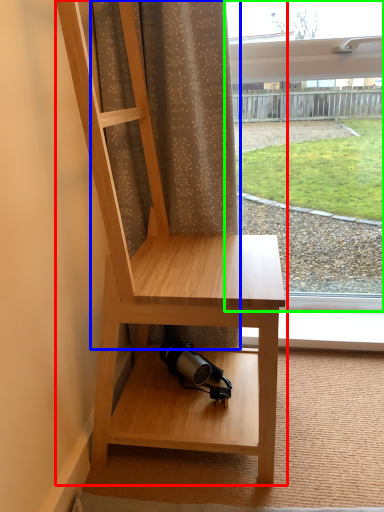
Question: Based on their relative distances, which object is nearer to furniture (highlighted by a red box)? Choose from curtain (highlighted by a blue box) and window (highlighted by a green box).

Choices:
 (A) curtain
 (B) window

Answer: (A)